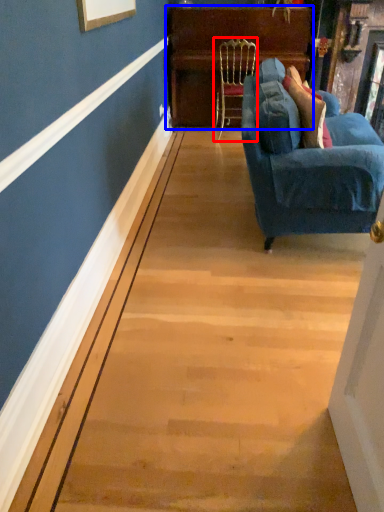
Question: Among these objects, which one is farthest to the camera, chair (highlighted by a red box) or dresser (highlighted by a blue box)?

Choices:
 (A) chair
 (B) dresser

Answer: (B)